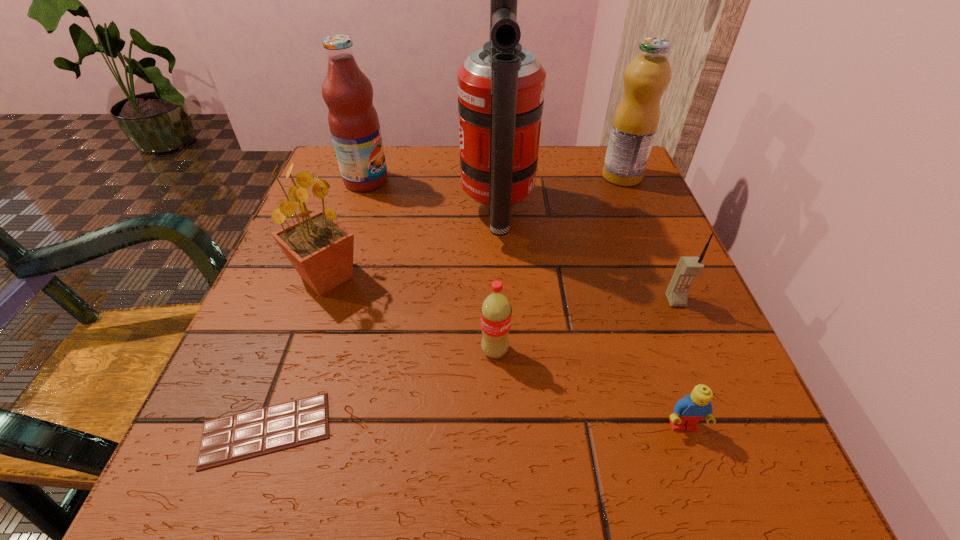
What are the coordinates of `object at the near left corner` in the screenshot? It's located at (248, 434).

Where is `object at the far right corner`? object at the far right corner is located at coordinates (635, 123).

This screenshot has width=960, height=540. I want to click on object situated at the near right corner, so click(688, 411).

In the image, there is a desktop. Find the location of `vacant space at the far edge`. vacant space at the far edge is located at coordinates (543, 150).

Locate an element on the screen. The height and width of the screenshot is (540, 960). vacant space at the left edge is located at coordinates (246, 403).

In the image, there is a desktop. Find the location of `vacant space at the right edge`. vacant space at the right edge is located at coordinates (618, 300).

Where is `free space at the far left corner of the desktop`? The width and height of the screenshot is (960, 540). free space at the far left corner of the desktop is located at coordinates (311, 194).

You are a GUI agent. You are given a task and a screenshot of the screen. Output one action in this format:
    pyautogui.click(x=<x>, y=<y>)
    Task: Click on the vacant space at the near left corner of the desktop
    The image size is (960, 540).
    Given the screenshot: What is the action you would take?
    pyautogui.click(x=259, y=462)

The image size is (960, 540). Find the location of `vacant space at the far right corner of the desktop`. vacant space at the far right corner of the desktop is located at coordinates (596, 194).

Where is `free space at the near right corner of the desktop`? The width and height of the screenshot is (960, 540). free space at the near right corner of the desktop is located at coordinates (759, 483).